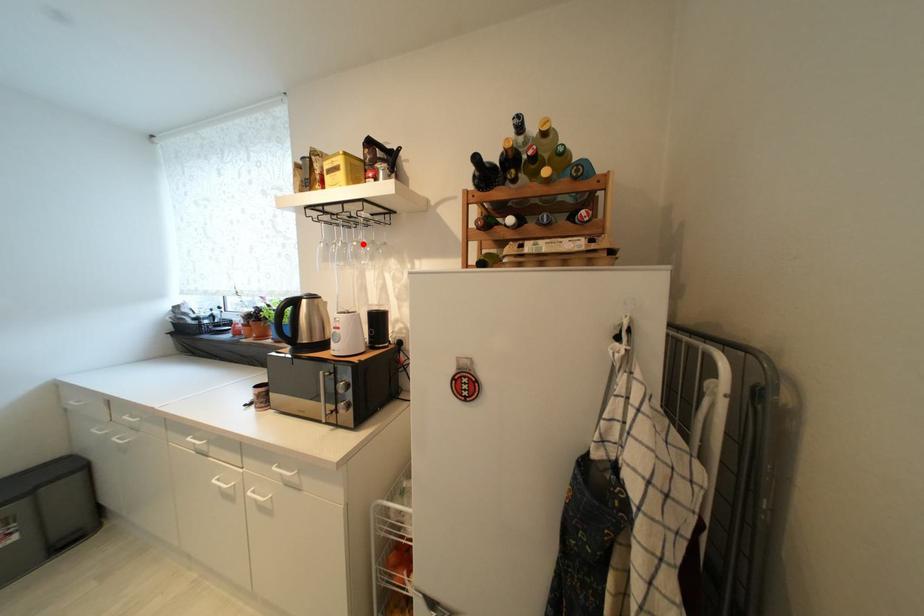
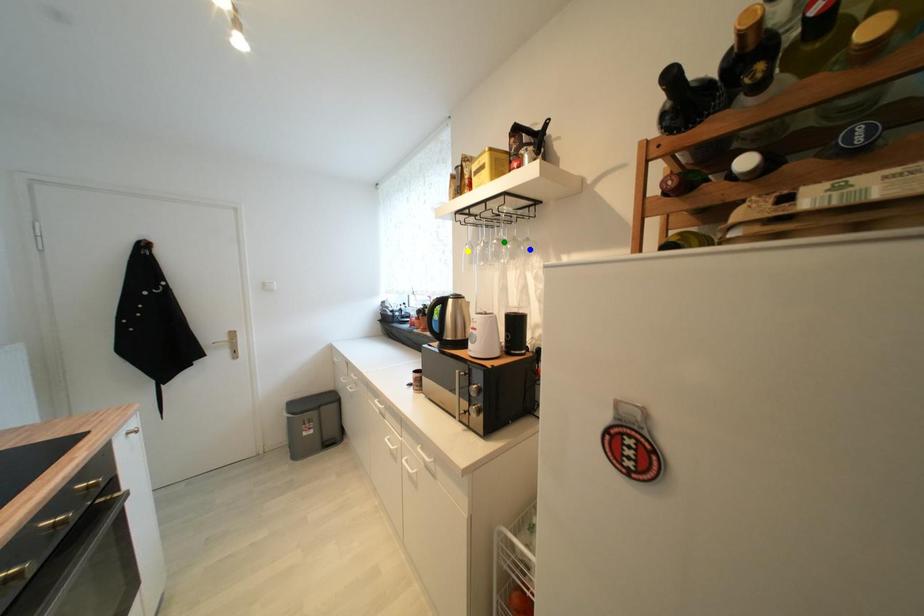
Question: I am providing you with two images of the same scene from different viewpoints. A red point is marked on the first image. You are given multiple points on the second image. In image 2, which mark is for the same physical point as the one in image 1?

Choices:
 (A) blue point
 (B) green point
 (C) yellow point

Answer: (B)